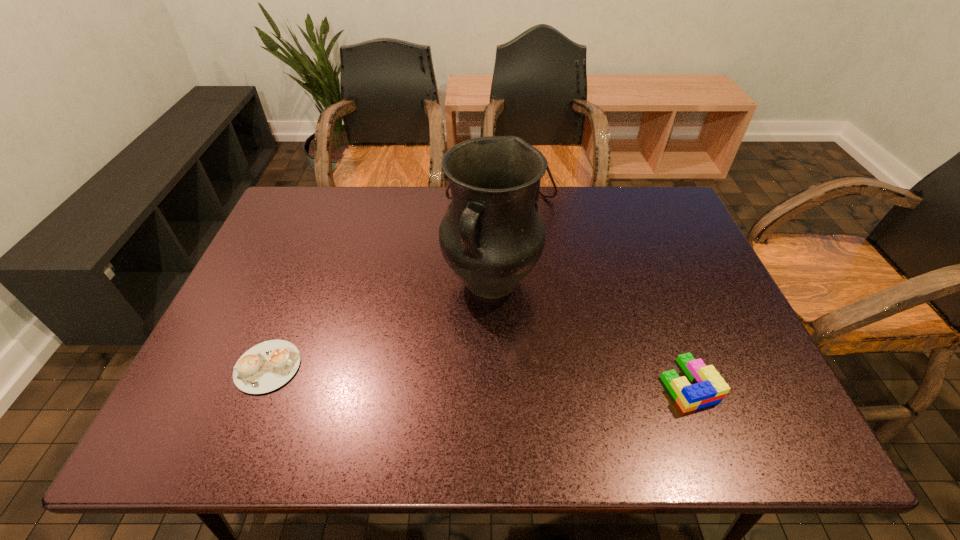
Identify the location of vacant spot on the desktop that is between the leftmost object and the rightmost object and is positioned on the front flap of the farthest object. This screenshot has height=540, width=960. (525, 377).

Locate an element on the screen. vacant spot on the desktop that is between the cappuccino and the third tallest object and is positioned on the handle side of the pitcher is located at coordinates (438, 374).